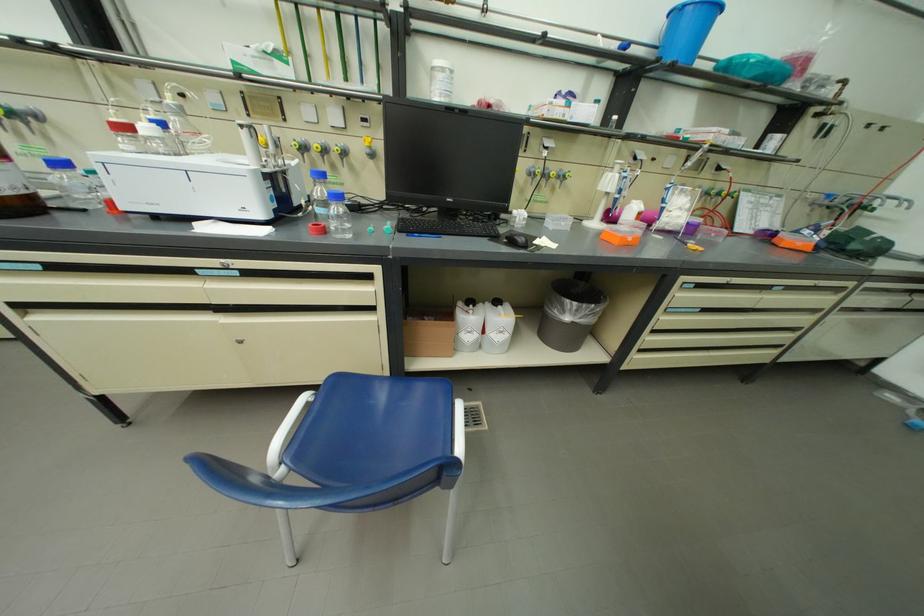
The location [687,30] corresponds to which object?

It refers to a blue plastic bucket.